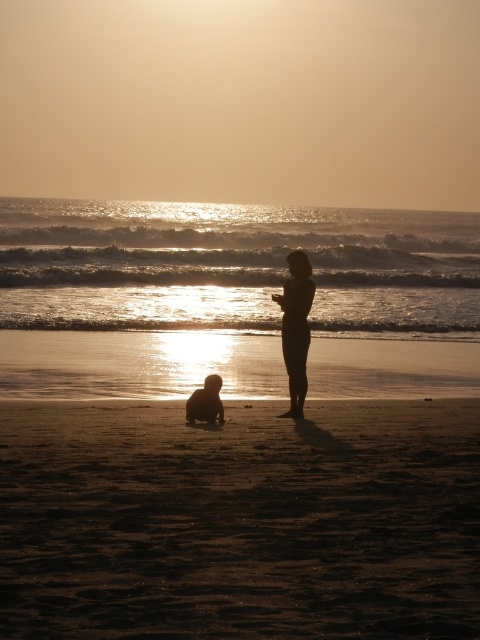
Question: Which of the following is the closest to the observer?

Choices:
 (A) (205, 401)
 (B) (351, 557)

Answer: (B)

Question: Which object is closer to the camera taking this photo?

Choices:
 (A) silhouette skin at center
 (B) silhouette sand at lower center

Answer: (B)

Question: Estimate the real-world distances between objects in this image. Which object is farther from the dark sand at center?

Choices:
 (A) silhouette sand at lower center
 (B) silhouette skin at center

Answer: (B)

Question: Is dark sand at center wider than silhouette sand at lower center?

Choices:
 (A) yes
 (B) no

Answer: (B)

Question: In this image, where is dark sand at center located relative to silhouette skin at center?

Choices:
 (A) left
 (B) right

Answer: (B)

Question: Observing the image, what is the correct spatial positioning of dark sand at center in reference to silhouette skin at center?

Choices:
 (A) right
 (B) left

Answer: (A)